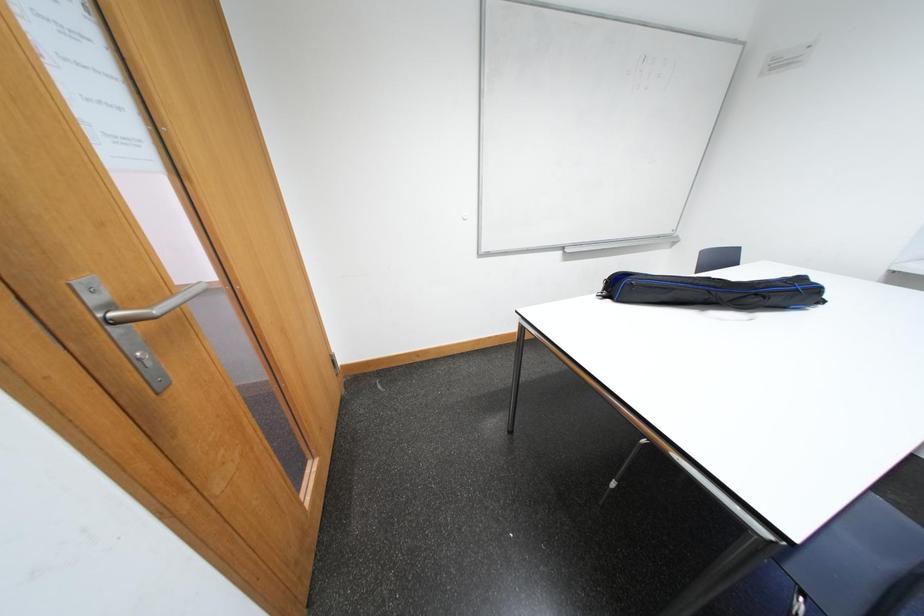
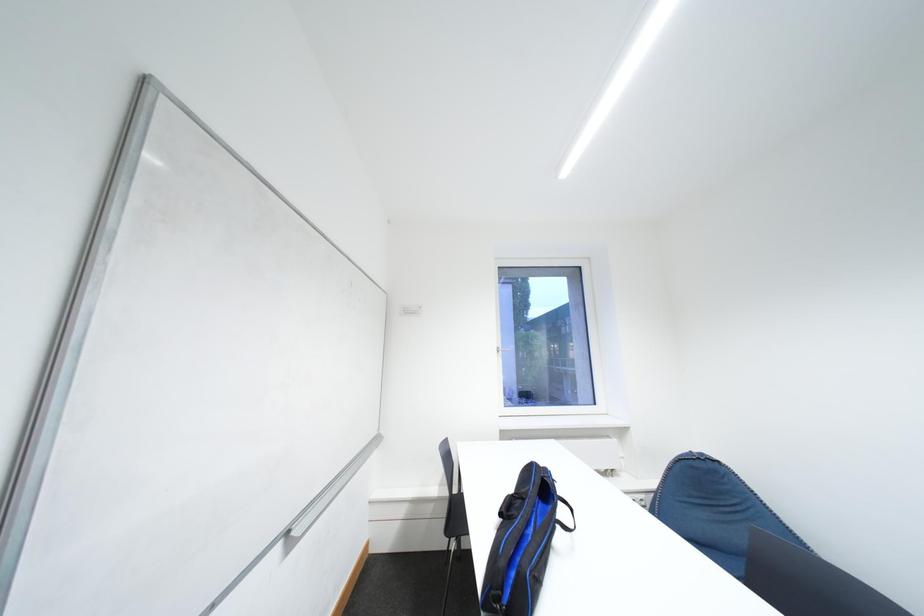
How did the camera likely rotate?

The camera rotated toward right-up.